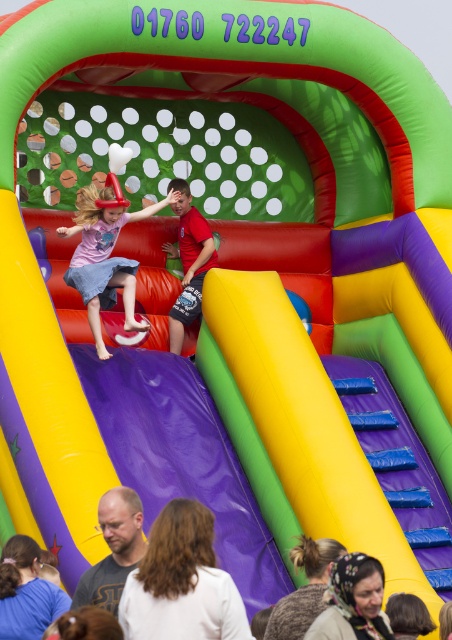
Who is shorter, matte pink dress at center or white cotton shirt at lower center?

With less height is white cotton shirt at lower center.

Is matte pink dress at center to the right of white cotton shirt at lower center from the viewer's perspective?

No, matte pink dress at center is not to the right of white cotton shirt at lower center.

The image size is (452, 640). What do you see at coordinates (104, 257) in the screenshot?
I see `matte pink dress at center` at bounding box center [104, 257].

Locate an element on the screen. The image size is (452, 640). matte pink dress at center is located at coordinates (104, 257).